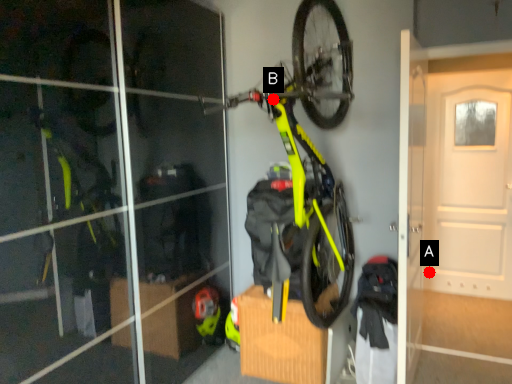
Question: Two points are circled on the image, labeled by A and B beside each circle. Among these points, which one is farthest from the camera?

Choices:
 (A) A is further
 (B) B is further

Answer: (A)